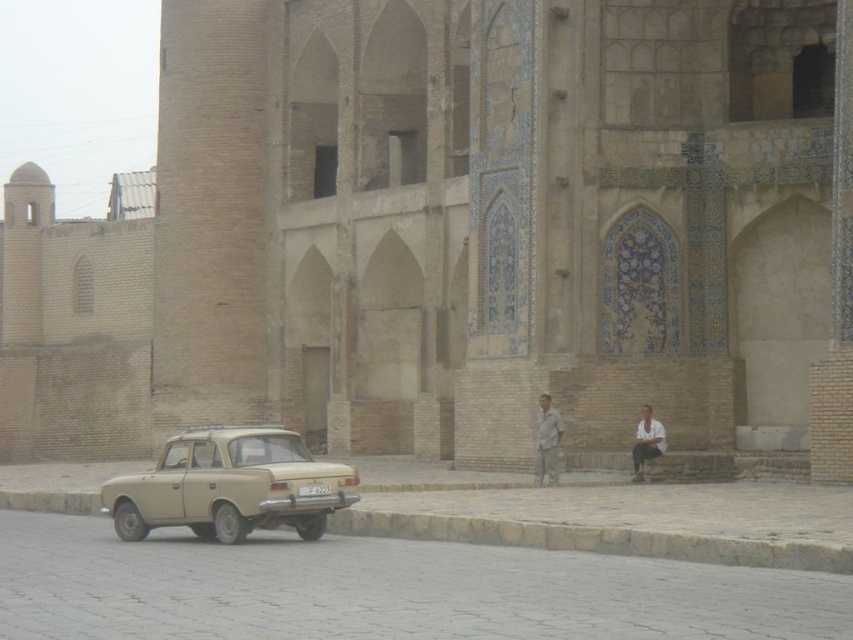
Which is below, beige matte car at lower left or brown stone curb at lower center?

beige matte car at lower left is below.

Image resolution: width=853 pixels, height=640 pixels. Identify the location of beige matte car at lower left. (230, 484).

Where is `beige matte car at lower left`? The width and height of the screenshot is (853, 640). beige matte car at lower left is located at coordinates (230, 484).

Based on the photo, who is positioned more to the right, smooth stone pavement at lower center or brown stone curb at lower center?

Positioned to the right is brown stone curb at lower center.

Who is more distant from viewer, (688, 618) or (608, 531)?

The point (608, 531) is more distant.

Is point (387, 560) positioned behind point (769, 554)?

Yes, point (387, 560) is behind point (769, 554).

I want to click on smooth stone pavement at lower center, so click(383, 589).

Is brown stone curb at lower center in front of white cotton shirt at lower right?

That is True.

Is brown stone curb at lower center shorter than white cotton shirt at lower right?

Correct, brown stone curb at lower center is not as tall as white cotton shirt at lower right.

At what (x,y) coordinates should I click in order to perform the action: click on brown stone curb at lower center. Please return your answer as a coordinate pair (x, y). This screenshot has height=640, width=853. Looking at the image, I should click on (596, 540).